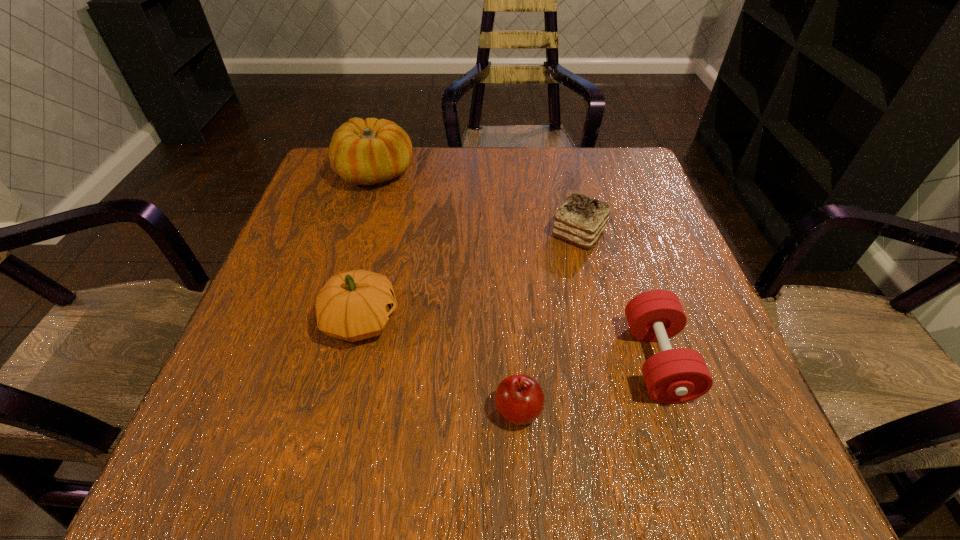
You are a GUI agent. You are given a task and a screenshot of the screen. Output one action in this format:
    pyautogui.click(x=<x>, y=<y>)
    Task: Click on the object located in the far edge section of the desktop
    The width and height of the screenshot is (960, 540).
    Given the screenshot: What is the action you would take?
    pyautogui.click(x=362, y=152)

This screenshot has width=960, height=540. I want to click on dumbbell present at the right edge, so click(678, 375).

The height and width of the screenshot is (540, 960). I want to click on chocolate cake located in the right edge section of the desktop, so click(580, 220).

Locate an element on the screen. This screenshot has width=960, height=540. object situated at the far left corner is located at coordinates (362, 152).

The height and width of the screenshot is (540, 960). In the image, there is a desktop. What are the coordinates of `vacant space at the far edge` in the screenshot? It's located at (449, 180).

In order to click on vacant area at the near edge of the desktop in this screenshot , I will do `click(546, 462)`.

Find the location of a particular element. Image resolution: width=960 pixels, height=540 pixels. blank area at the left edge is located at coordinates (247, 318).

Locate an element on the screen. The height and width of the screenshot is (540, 960). free space at the right edge is located at coordinates (713, 352).

This screenshot has height=540, width=960. What are the coordinates of `free space at the far left corner` in the screenshot? It's located at (319, 191).

Find the location of a particular element. This screenshot has width=960, height=540. vacant area at the far right corner is located at coordinates tap(612, 163).